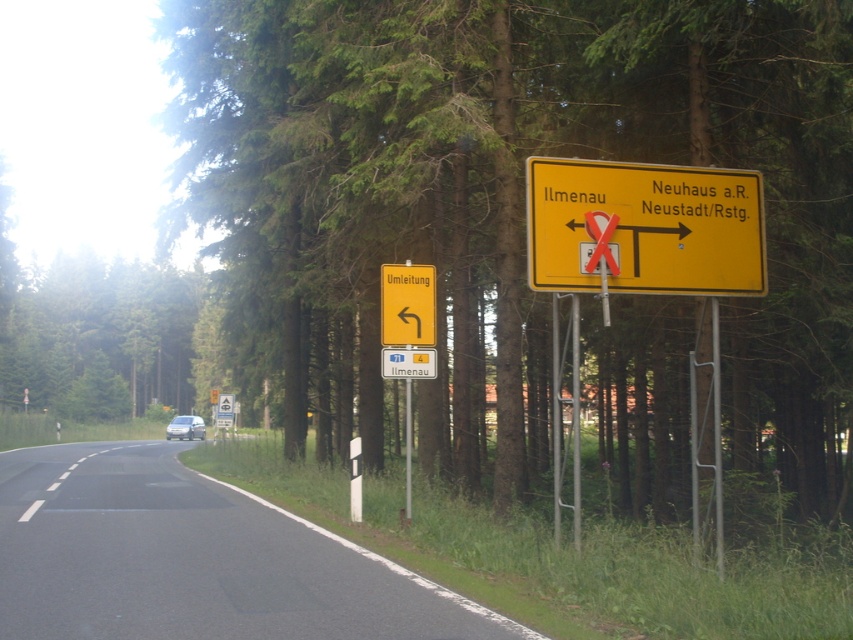
You are driving a car and want to check the road sign for directions while passing the white matte van at center. Can you see the yellow plastic road sign at upper center clearly from your current position?

The yellow plastic road sign at upper center is closer to the viewer than the white matte van at center, so yes, you can see the yellow plastic road sign at upper center clearly from your current position as it is in front of the van.

You are driving a car on the rural road and need to read both the yellow matte sign at upper right and the yellow plastic road sign at upper center. Which sign should you look up to see first?

The yellow matte sign at upper right is located above the yellow plastic road sign at upper center, so you should look up to see the yellow matte sign at upper right first.

You are driving a car and see the yellow matte sign at upper right and the white matte van at center ahead on the road. Which object is closer to you?

The yellow matte sign at upper right is closer to you because it is in front of the white matte van at center, meaning it is nearer along the line of sight.